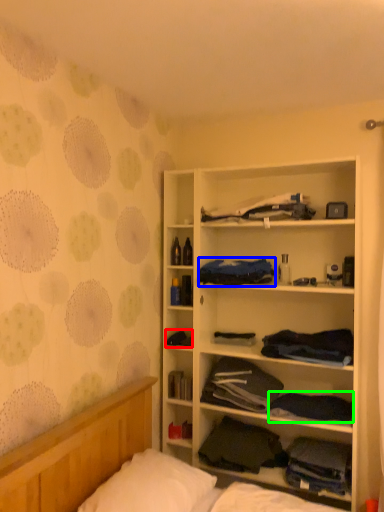
Question: Which is nearer to the clothing (highlighted by a red box)? clothing (highlighted by a blue box) or clothing (highlighted by a green box).

Choices:
 (A) clothing
 (B) clothing

Answer: (A)